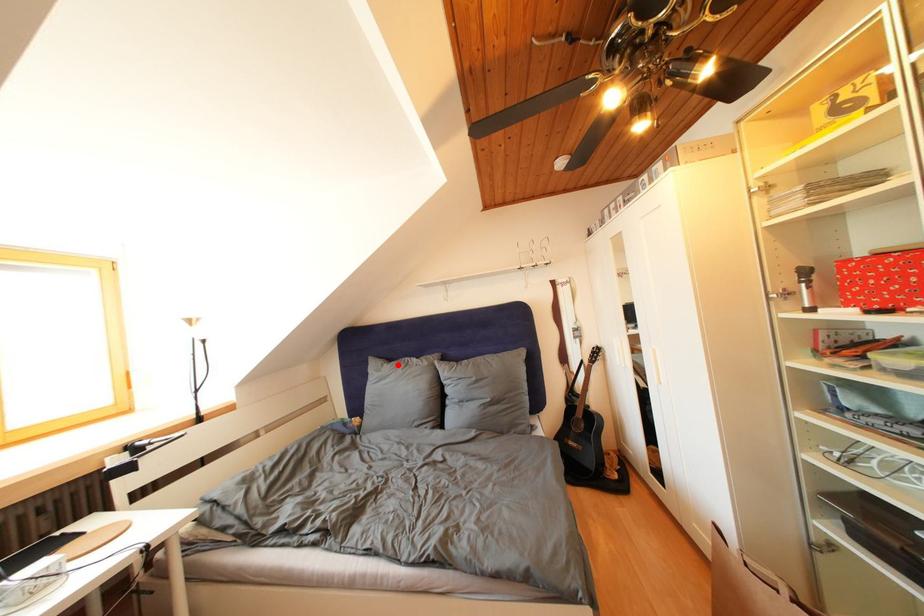
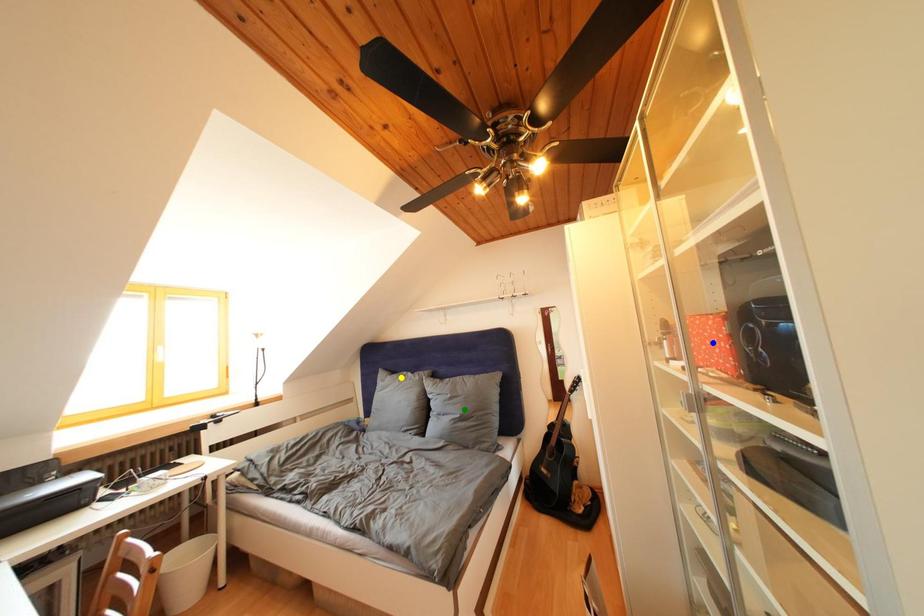
Question: I am providing you with two images of the same scene from different viewpoints. A red point is marked on the first image. You are given multiple points on the second image. Which spot in image 2 lines up with the point in image 1?

Choices:
 (A) green point
 (B) blue point
 (C) yellow point

Answer: (C)